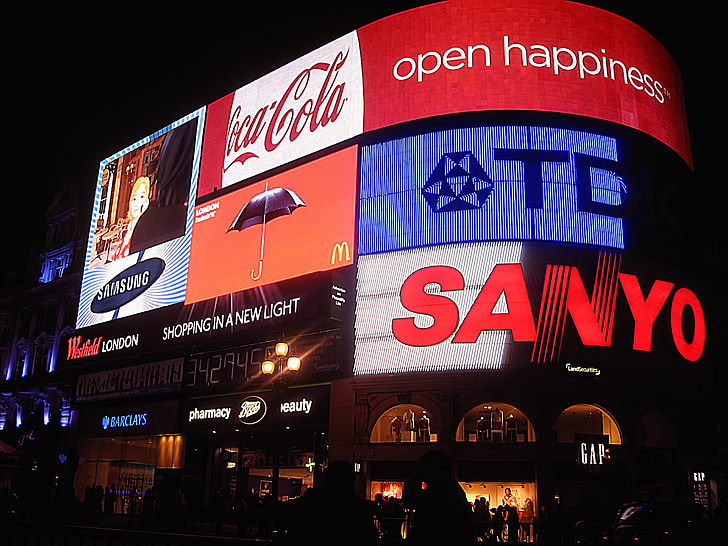
Identify the location of screen. (523, 77), (312, 189), (462, 233), (201, 371), (183, 333), (162, 225), (538, 314).